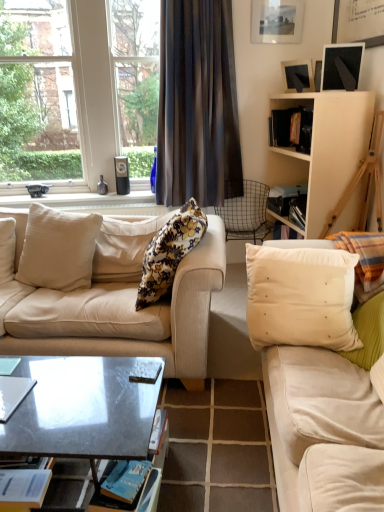
Image resolution: width=384 pixels, height=512 pixels. Find the location of `free spot behind matte gray magazine at lower left, which is counted as the 1th magazine, starting from the top`. free spot behind matte gray magazine at lower left, which is counted as the 1th magazine, starting from the top is located at coordinates (23, 367).